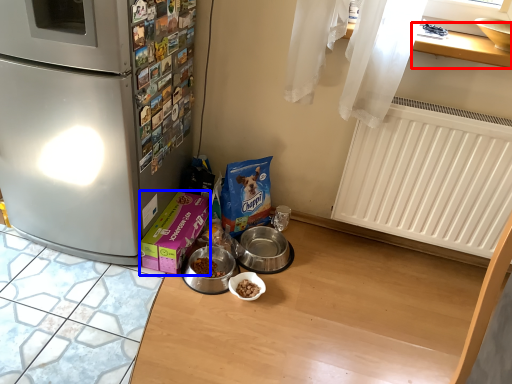
Question: Which object appears closest to the camera in this image, window sill (highlighted by a red box) or box (highlighted by a blue box)?

Choices:
 (A) window sill
 (B) box

Answer: (A)